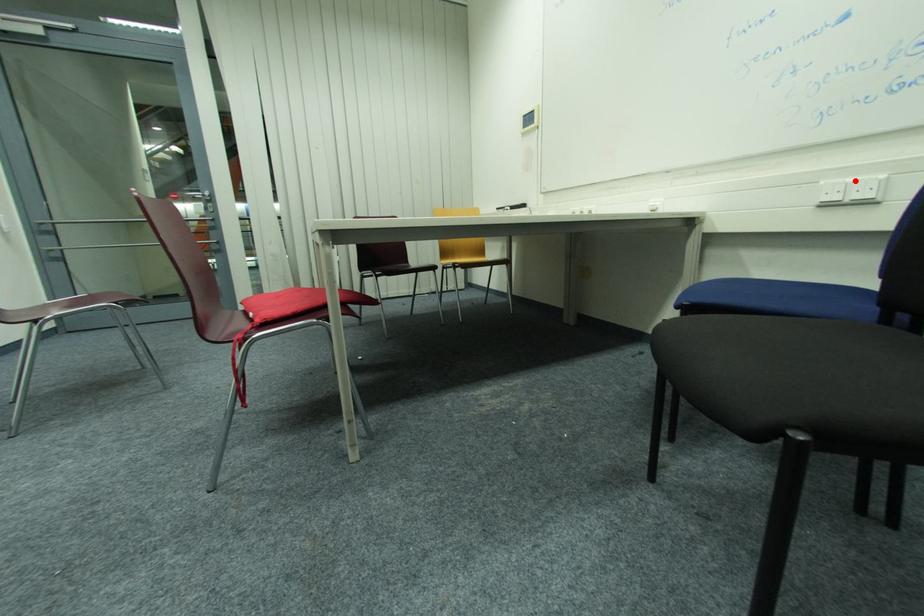
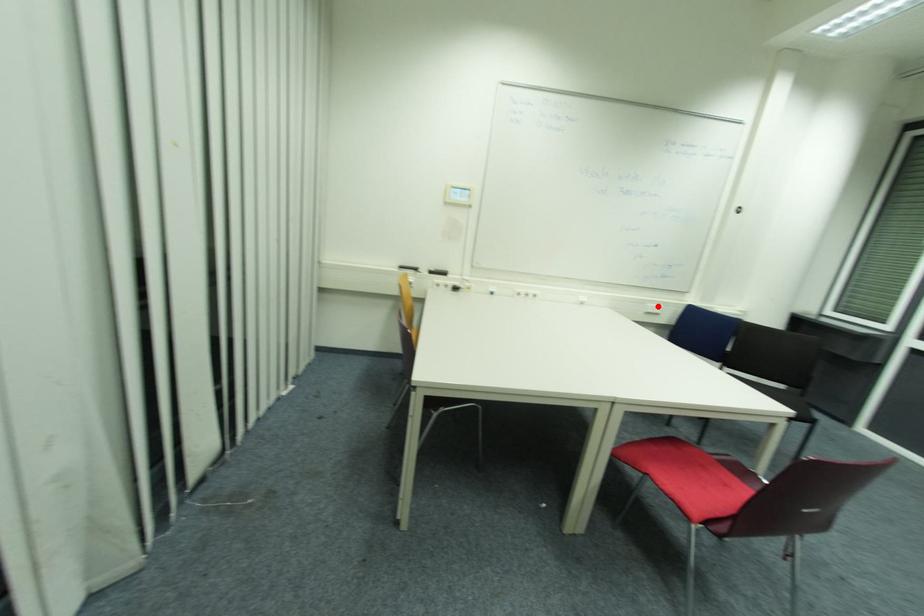
I am providing you with two images of the same scene from different viewpoints. A red point is marked on the first image and another point is marked on the second image. Is the red point in image1 aligned with the point shown in image2?

Yes